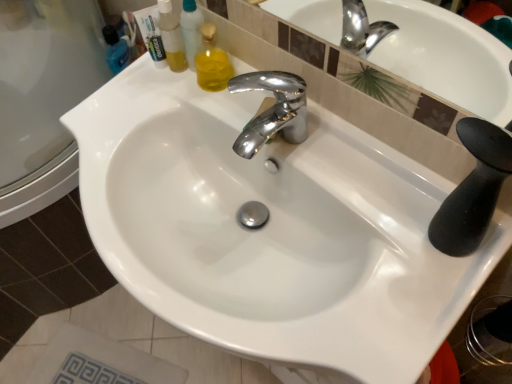
Identify the location of vacant space to the right of chrome metallic faucet at center. This screenshot has height=384, width=512. (335, 145).